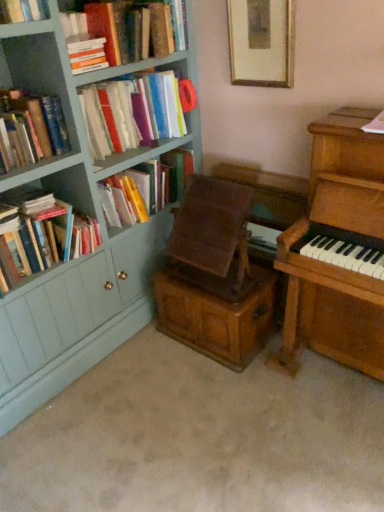
Question: Looking at their shapes, would you say hardcover book at upper left, arranged as the 2th book when viewed from the top, is wider or thinner than wooden chest at center?

Choices:
 (A) wide
 (B) thin

Answer: (B)

Question: Would you say hardcover book at upper left, which is the 5th book from bottom to top, is to the left or to the right of wooden chest at center in the picture?

Choices:
 (A) left
 (B) right

Answer: (A)

Question: Estimate the real-world distances between objects in this image. Which object is farther from the hardcover books at upper left, the fourth book positioned from the bottom?

Choices:
 (A) hardcover book at left, the 2th book ordered from the bottom
 (B) hardcover books at upper left, the 6th book ordered from the bottom
 (C) wooden piano at right
 (D) hardcover books at left, the 6th book in the top-to-bottom sequence
 (E) wooden picture frame at upper center

Answer: (C)

Question: Based on their relative distances, which object is nearer to the wooden chest at center?

Choices:
 (A) hardcover books at left, positioned as the fourth book in top-to-bottom order
 (B) hardcover book at left, the 5th book viewed from the top
 (C) hardcover books at upper left, the fourth book positioned from the bottom
 (D) hardcover books at upper left, which appears as the first book when viewed from the top
 (E) hardcover books at left, which is counted as the first book, starting from the bottom

Answer: (B)